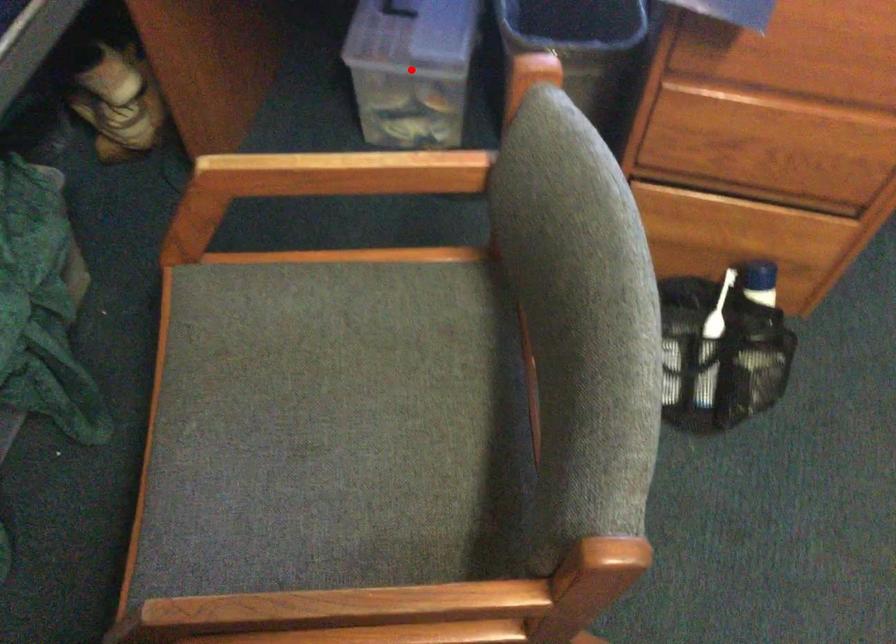
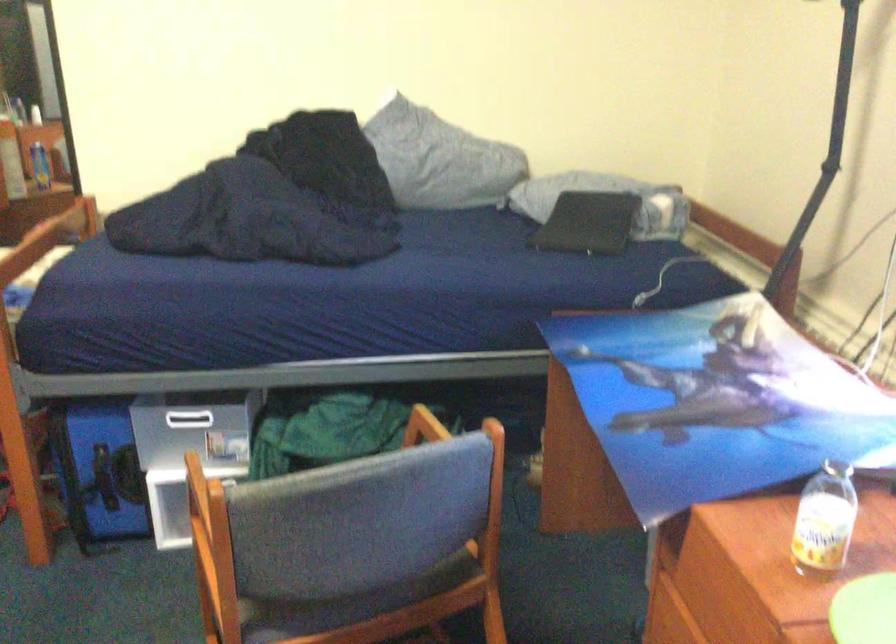
Question: I am providing you with two images of the same scene from different viewpoints. A red point is marked on the first image. Can you still see the location of the red point in image 2?

Choices:
 (A) Yes
 (B) No

Answer: (B)